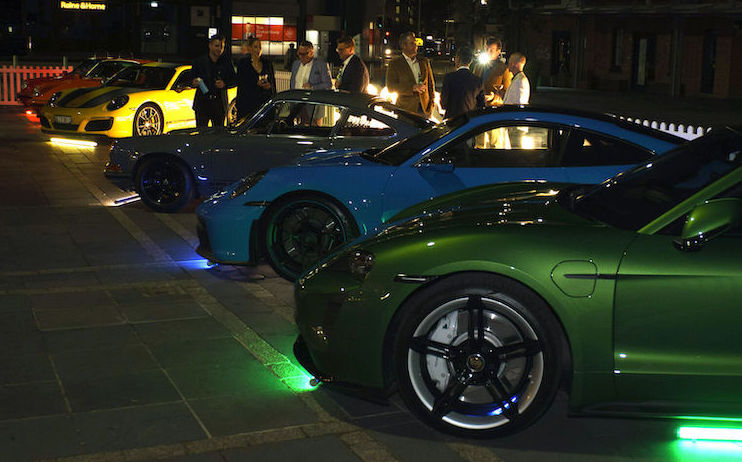
The width and height of the screenshot is (742, 462). I want to click on lights, so click(650, 295), click(306, 388), click(194, 272), click(130, 192), click(53, 145), click(27, 117), click(692, 455).